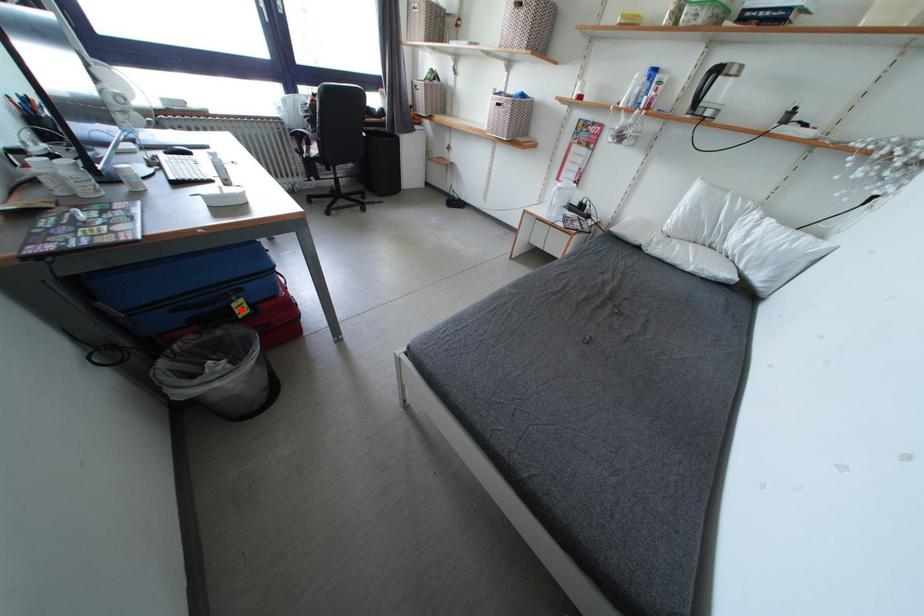
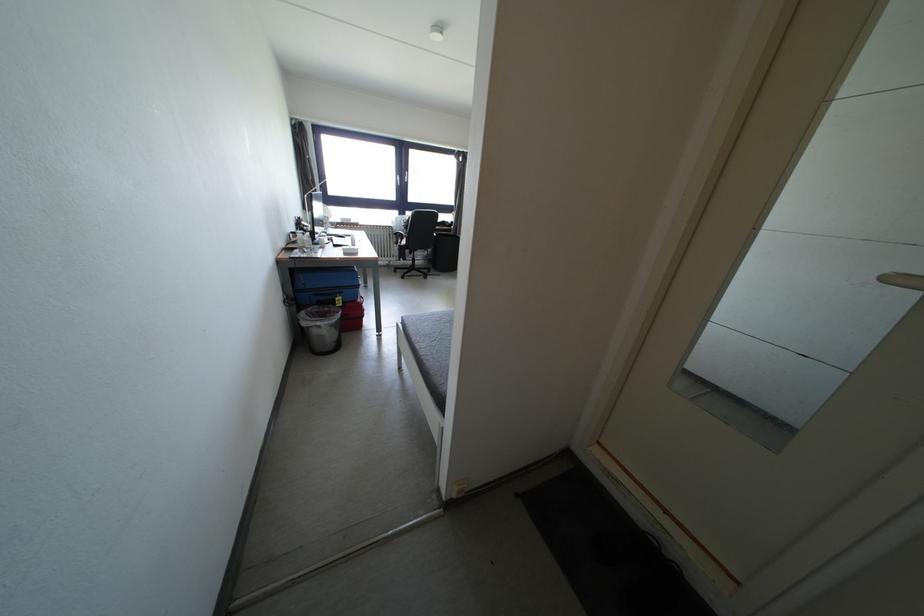
In the second image, find the point that corresponds to the highlighted location in the first image.

(344, 302)